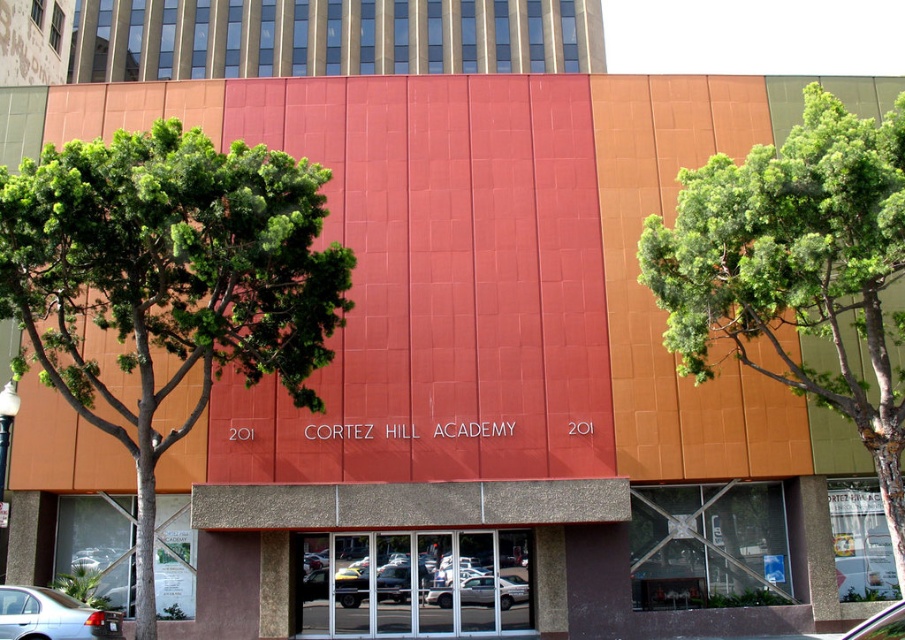
Question: Which point appears farthest from the camera in this image?

Choices:
 (A) (875, 625)
 (B) (20, 595)
 (C) (518, 582)
 (D) (472, 582)

Answer: (C)

Question: Can you confirm if matte black sedan at center is bigger than metallic silver car at center?

Choices:
 (A) yes
 (B) no

Answer: (B)

Question: From the image, what is the correct spatial relationship of green leafy tree at left in relation to silver metallic sedan at lower left?

Choices:
 (A) left
 (B) right

Answer: (B)

Question: Estimate the real-world distances between objects in this image. Which object is closer to the green leafy tree at upper right?

Choices:
 (A) silver metallic sedan at lower left
 (B) silver metallic sedan at center
 (C) green leafy tree at left
 (D) metallic silver car at center

Answer: (D)

Question: Does matte black sedan at center lie behind silver metallic sedan at lower left?

Choices:
 (A) no
 (B) yes

Answer: (B)

Question: Which object is the farthest from the metallic silver car at center?

Choices:
 (A) silver metallic sedan at lower left
 (B) silver metallic sedan at center

Answer: (A)